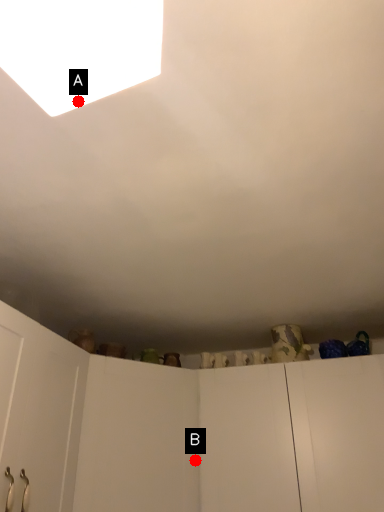
Question: Two points are circled on the image, labeled by A and B beside each circle. Which point is closer to the camera taking this photo?

Choices:
 (A) A is closer
 (B) B is closer

Answer: (A)